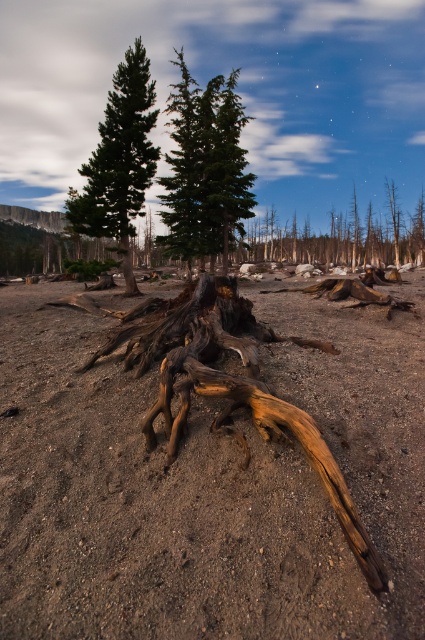
Question: Does brown dirt field at center appear over green matte tree at center?

Choices:
 (A) no
 (B) yes

Answer: (A)

Question: Can you confirm if green matte tree at center is bigger than brown rough tree trunk at center?

Choices:
 (A) no
 (B) yes

Answer: (B)

Question: Is green matte tree at center behind brown rough tree trunk at center?

Choices:
 (A) yes
 (B) no

Answer: (A)

Question: Which point is closer to the camera?

Choices:
 (A) (159, 492)
 (B) (122, 76)
 (C) (275, 234)

Answer: (A)

Question: Among these objects, which one is nearest to the camera?

Choices:
 (A) brown rough tree trunk at center
 (B) brown dirt field at center
 (C) green matte tree at upper left

Answer: (B)

Question: Among these points, which one is farthest from the camera?

Choices:
 (A) (153, 173)
 (B) (370, 250)
 (C) (181, 240)
 (D) (130, 253)

Answer: (B)